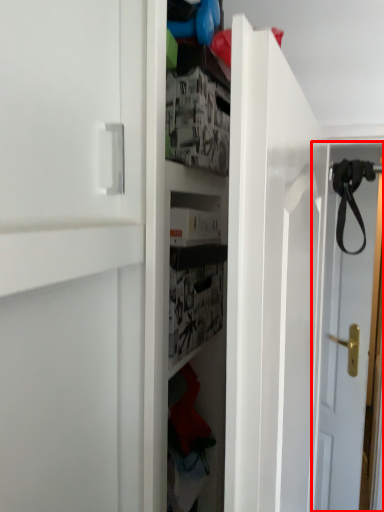
Question: From the image's perspective, considering the relative positions of door (annotated by the red box) and strap in the image provided, where is door (annotated by the red box) located with respect to the staircase?

Choices:
 (A) above
 (B) below

Answer: (B)